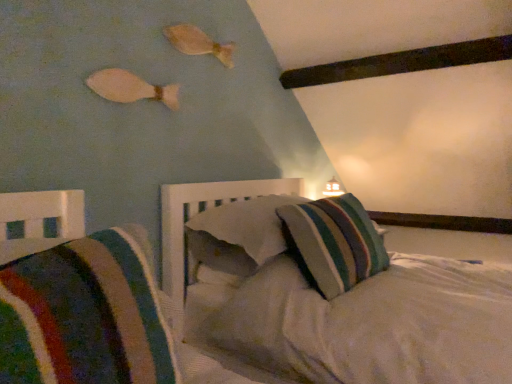
Measure the distance between point (65, 301) and camera.

The distance of point (65, 301) from camera is 24.69 inches.

Where is `white matte fish at upper left, the 1th fish in the left-to-right sequence`? This screenshot has height=384, width=512. white matte fish at upper left, the 1th fish in the left-to-right sequence is located at coordinates click(x=130, y=88).

Locate an element on the screen. Image resolution: width=512 pixels, height=384 pixels. wooden fish at upper center, placed as the first fish when sorted from back to front is located at coordinates (198, 43).

Is striped fabric pillow at center, which is the second pillow in back-to-front order, at the back of wooden fish at upper center, the 2th fish in the bottom-to-top sequence?

That's not correct — wooden fish at upper center, the 2th fish in the bottom-to-top sequence, is not looking away from striped fabric pillow at center, which is the second pillow in back-to-front order.

From their relative heights in the image, would you say wooden fish at upper center, placed as the first fish when sorted from back to front, is taller or shorter than striped fabric pillow at center, which is the second pillow in back-to-front order?

Considering their sizes, wooden fish at upper center, placed as the first fish when sorted from back to front, has less height than striped fabric pillow at center, which is the second pillow in back-to-front order.

Does point (182, 44) appear closer or farther from the camera than point (292, 212)?

Clearly, point (182, 44) is more distant from the camera than point (292, 212).

Considering the sizes of objects wooden fish at upper center, arranged as the 1th fish when viewed from the right, and striped fabric pillow at center, which is the second pillow in back-to-front order, in the image provided, who is bigger, wooden fish at upper center, arranged as the 1th fish when viewed from the right, or striped fabric pillow at center, which is the second pillow in back-to-front order,?

striped fabric pillow at center, which is the second pillow in back-to-front order.

Relative to striped fabric pillow at center, which is the 1th pillow in front-to-back order, is wooden fish at upper center, the 2th fish in the bottom-to-top sequence, in front or behind?

Clearly, wooden fish at upper center, the 2th fish in the bottom-to-top sequence, is behind striped fabric pillow at center, which is the 1th pillow in front-to-back order.

From a real-world perspective, which object rests below the other?

striped fabric pillow at center, which is the 1th pillow in front-to-back order, from a real-world perspective.

Is wooden fish at upper center, arranged as the 1th fish when viewed from the right, shorter than striped fabric pillow at center, which is the 1th pillow in front-to-back order?

Indeed, wooden fish at upper center, arranged as the 1th fish when viewed from the right, has a lesser height compared to striped fabric pillow at center, which is the 1th pillow in front-to-back order.

Consider the image. Can you see wooden fish at upper center, the second fish viewed from the front, touching striped fabric pillow at center, which ranks as the third pillow in back-to-front order?

They are not placed beside each other.

Is white matte fish at upper left, the 2th fish positioned from the right, oriented towards striped fabric pillow at center, placed as the first pillow when sorted from back to front?

No.

Is white matte fish at upper left, the 1th fish in the left-to-right sequence, shorter than striped fabric pillow at center, marked as the 3th pillow in a front-to-back arrangement?

Indeed, white matte fish at upper left, the 1th fish in the left-to-right sequence, has a lesser height compared to striped fabric pillow at center, marked as the 3th pillow in a front-to-back arrangement.

Can you confirm if white matte fish at upper left, the 1th fish in the left-to-right sequence, is bigger than striped fabric pillow at center, placed as the first pillow when sorted from back to front?

Actually, white matte fish at upper left, the 1th fish in the left-to-right sequence, might be smaller than striped fabric pillow at center, placed as the first pillow when sorted from back to front.

Identify the location of the 1st fish above when counting from the striped fabric pillow at center, marked as the 3th pillow in a front-to-back arrangement (from the image's perspective). The image size is (512, 384). (130, 88).

Is point (350, 285) closer to camera compared to point (188, 28)?

Yes, point (350, 285) is closer to viewer.

From a real-world perspective, which is physically above, striped fabric pillow at center, the second pillow positioned from the front, or wooden fish at upper center, arranged as the 1th fish when viewed from the right?

wooden fish at upper center, arranged as the 1th fish when viewed from the right, is physically above.

Does striped fabric pillow at center, which is the second pillow in back-to-front order, have a lesser height compared to wooden fish at upper center, the first fish in the top-to-bottom sequence?

No.

From the image's perspective, is striped fabric pillow at center, the second pillow positioned from the front, positioned above or below wooden fish at upper center, placed as the first fish when sorted from back to front?

From the image's perspective, striped fabric pillow at center, the second pillow positioned from the front, appears below wooden fish at upper center, placed as the first fish when sorted from back to front.

From the image's perspective, who appears lower, striped fabric pillow at center, which is the 1th pillow in front-to-back order, or striped fabric pillow at center, the second pillow positioned from the front?

striped fabric pillow at center, which is the 1th pillow in front-to-back order.

Between striped fabric pillow at center, which is the 1th pillow in front-to-back order, and striped fabric pillow at center, the second pillow positioned from the front, which one has smaller size?

Smaller between the two is striped fabric pillow at center, which is the 1th pillow in front-to-back order.

Considering the relative positions of striped fabric pillow at center, which is the 1th pillow in front-to-back order, and striped fabric pillow at center, which is the second pillow in back-to-front order, in the image provided, is striped fabric pillow at center, which is the 1th pillow in front-to-back order, in front of striped fabric pillow at center, which is the second pillow in back-to-front order,?

Yes, it is.

How far apart are striped fabric pillow at center, which ranks as the third pillow in back-to-front order, and striped fabric pillow at center, the second pillow positioned from the front?

striped fabric pillow at center, which ranks as the third pillow in back-to-front order, and striped fabric pillow at center, the second pillow positioned from the front, are 34.36 inches apart from each other.

Considering the relative sizes of wooden fish at upper center, arranged as the 1th fish when viewed from the right, and striped fabric pillow at center, placed as the first pillow when sorted from back to front, in the image provided, is wooden fish at upper center, arranged as the 1th fish when viewed from the right, bigger than striped fabric pillow at center, placed as the first pillow when sorted from back to front,?

No.

Is wooden fish at upper center, the 2th fish in the bottom-to-top sequence, far from striped fabric pillow at center, placed as the first pillow when sorted from back to front?

wooden fish at upper center, the 2th fish in the bottom-to-top sequence, is actually quite close to striped fabric pillow at center, placed as the first pillow when sorted from back to front.

Which object is thinner, wooden fish at upper center, placed as the first fish when sorted from back to front, or striped fabric pillow at center, placed as the first pillow when sorted from back to front?

With smaller width is wooden fish at upper center, placed as the first fish when sorted from back to front.

Based on the photo, is the depth of wooden fish at upper center, the 2th fish in the bottom-to-top sequence, greater than that of striped fabric pillow at center, placed as the first pillow when sorted from back to front?

Yes, wooden fish at upper center, the 2th fish in the bottom-to-top sequence, is behind striped fabric pillow at center, placed as the first pillow when sorted from back to front.

In the scene shown: Is wooden fish at upper center, the second fish viewed from the front, completely or partially inside white matte fish at upper left, which is counted as the 2th fish, starting from the top?

No, white matte fish at upper left, which is counted as the 2th fish, starting from the top, does not contain wooden fish at upper center, the second fish viewed from the front.

Consider the image. Who is taller, white matte fish at upper left, the first fish when ordered from front to back, or wooden fish at upper center, the first fish in the top-to-bottom sequence?

wooden fish at upper center, the first fish in the top-to-bottom sequence.

Find the location of `fish above the white matte fish at upper left, the 1th fish in the left-to-right sequence (from a real-world perspective)`. fish above the white matte fish at upper left, the 1th fish in the left-to-right sequence (from a real-world perspective) is located at coordinates (198, 43).

Is white matte fish at upper left, the 2th fish positioned from the right, to the left or to the right of wooden fish at upper center, arranged as the 1th fish when viewed from the right, in the image?

white matte fish at upper left, the 2th fish positioned from the right, is to the left of wooden fish at upper center, arranged as the 1th fish when viewed from the right.

Identify the location of the 2nd pillow in front of the wooden fish at upper center, the 2th fish in the bottom-to-top sequence. The width and height of the screenshot is (512, 384). (334, 242).

Find the location of a particular element. This screenshot has height=384, width=512. pillow on the left of wooden fish at upper center, the first fish in the top-to-bottom sequence is located at coordinates (83, 316).

Which object lies further to the anchor point striped fabric pillow at center, the second pillow positioned from the front, white matte fish at upper left, which is counted as the second fish, starting from the back, or striped fabric pillow at center, marked as the 3th pillow in a front-to-back arrangement?

The object further to striped fabric pillow at center, the second pillow positioned from the front, is white matte fish at upper left, which is counted as the second fish, starting from the back.

Looking at this image, considering their positions, is striped fabric pillow at center, the second pillow positioned from the front, positioned closer to striped fabric pillow at center, which ranks as the third pillow in back-to-front order, than striped fabric pillow at center, marked as the 3th pillow in a front-to-back arrangement?

The object closer to striped fabric pillow at center, which ranks as the third pillow in back-to-front order, is striped fabric pillow at center, marked as the 3th pillow in a front-to-back arrangement.

Estimate the real-world distances between objects in this image. Which object is closer to striped fabric pillow at center, which is the 1th pillow in front-to-back order, white matte fish at upper left, the first fish when ordered from front to back, or wooden fish at upper center, the second fish viewed from the front?

white matte fish at upper left, the first fish when ordered from front to back, is positioned closer to the anchor striped fabric pillow at center, which is the 1th pillow in front-to-back order.

Based on their spatial positions, is wooden fish at upper center, which is the second fish in left-to-right order, or striped fabric pillow at center, which is the second pillow in back-to-front order, further from white matte fish at upper left, which is counted as the first fish, starting from the bottom?

striped fabric pillow at center, which is the second pillow in back-to-front order, lies further to white matte fish at upper left, which is counted as the first fish, starting from the bottom, than the other object.

Based on their spatial positions, is wooden fish at upper center, the first fish in the top-to-bottom sequence, or striped fabric pillow at center, marked as the 3th pillow in a front-to-back arrangement, further from striped fabric pillow at center, which is the second pillow in back-to-front order?

Based on the image, wooden fish at upper center, the first fish in the top-to-bottom sequence, appears to be further to striped fabric pillow at center, which is the second pillow in back-to-front order.

From the image, which object appears to be nearer to striped fabric pillow at center, marked as the 3th pillow in a front-to-back arrangement, striped fabric pillow at center, which is the 1th pillow in front-to-back order, or wooden fish at upper center, which is the second fish in left-to-right order?

wooden fish at upper center, which is the second fish in left-to-right order, lies closer to striped fabric pillow at center, marked as the 3th pillow in a front-to-back arrangement, than the other object.

From the image, which object appears to be nearer to striped fabric pillow at center, which ranks as the third pillow in back-to-front order, striped fabric pillow at center, marked as the 3th pillow in a front-to-back arrangement, or striped fabric pillow at center, which is the second pillow in back-to-front order?

striped fabric pillow at center, marked as the 3th pillow in a front-to-back arrangement.

Based on their spatial positions, is striped fabric pillow at center, the second pillow positioned from the front, or white matte fish at upper left, the first fish when ordered from front to back, further from striped fabric pillow at center, which is the 1th pillow in front-to-back order?

Among the two, white matte fish at upper left, the first fish when ordered from front to back, is located further to striped fabric pillow at center, which is the 1th pillow in front-to-back order.

You are a GUI agent. You are given a task and a screenshot of the screen. Output one action in this format:
    pyautogui.click(x=<x>, y=<y>)
    Task: Click on the pillow between striped fabric pillow at center, which ranks as the third pillow in back-to-front order, and striped fabric pillow at center, the second pillow positioned from the front, from left to right
    
    Given the screenshot: What is the action you would take?
    pyautogui.click(x=247, y=225)

This screenshot has width=512, height=384. What are the coordinates of `pillow between wooden fish at upper center, the 2th fish in the bottom-to-top sequence, and striped fabric pillow at center, which is the second pillow in back-to-front order, vertically` in the screenshot? It's located at (247, 225).

The height and width of the screenshot is (384, 512). Find the location of `fish between wooden fish at upper center, the first fish in the top-to-bottom sequence, and striped fabric pillow at center, marked as the 3th pillow in a front-to-back arrangement, in the up-down direction`. fish between wooden fish at upper center, the first fish in the top-to-bottom sequence, and striped fabric pillow at center, marked as the 3th pillow in a front-to-back arrangement, in the up-down direction is located at coordinates (130, 88).

Image resolution: width=512 pixels, height=384 pixels. What are the coordinates of `fish between wooden fish at upper center, the first fish in the top-to-bottom sequence, and striped fabric pillow at center, the second pillow positioned from the front, in the up-down direction` in the screenshot? It's located at (130, 88).